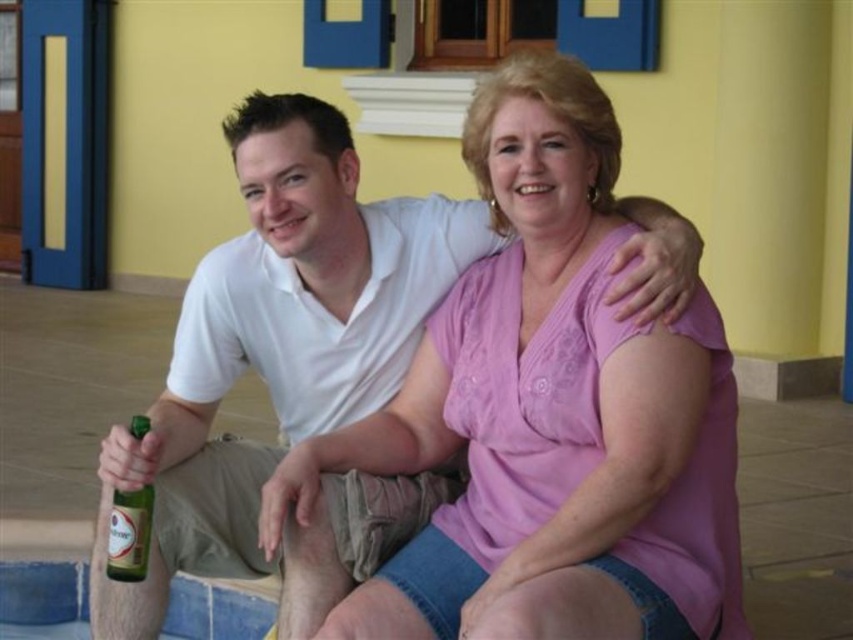
Based on the scene description, can you determine if the pink cotton shirt at center is positioned higher than the green glass bottle at lower left?

Yes, the pink cotton shirt at center is positioned higher than the green glass bottle at lower left because the description states that the pink cotton shirt at center is above the green glass bottle at lower left.

You are organizing a clothing and beverage display. You have a pink cotton shirt at center and a green glass bottle at lower left. If you want to arrange them side by side on a shelf, which item should be placed first to accommodate their widths?

The pink cotton shirt at center should be placed first because it is wider than the green glass bottle at lower left, so it requires more space on the shelf.